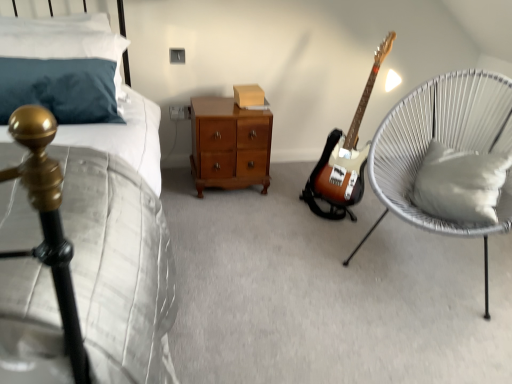
Question: Which is correct: white soft cushion at right, placed as the 2th pillow when sorted from top to bottom, is inside matte cardboard box at center, or outside of it?

Choices:
 (A) outside
 (B) inside

Answer: (A)

Question: From a real-world perspective, is white soft cushion at right, placed as the 2th pillow when sorted from top to bottom, physically located above or below matte cardboard box at center?

Choices:
 (A) below
 (B) above

Answer: (A)

Question: Estimate the real-world distances between objects in this image. Which object is farther from the matte gold headboard at left?

Choices:
 (A) sunburst wood electric guitar at center
 (B) white soft cushion at right, which is the 1th pillow from bottom to top
 (C) white woven chair at right
 (D) matte cardboard box at center
 (E) teal fabric pillow at upper left, which appears as the second pillow when ordered from the bottom

Answer: (B)

Question: Estimate the real-world distances between objects in this image. Which object is farther from the teal fabric pillow at upper left, which appears as the second pillow when ordered from the bottom?

Choices:
 (A) sunburst wood electric guitar at center
 (B) matte gold headboard at left
 (C) white soft cushion at right, which is the 2th pillow in left-to-right order
 (D) white woven chair at right
 (E) matte cardboard box at center

Answer: (C)